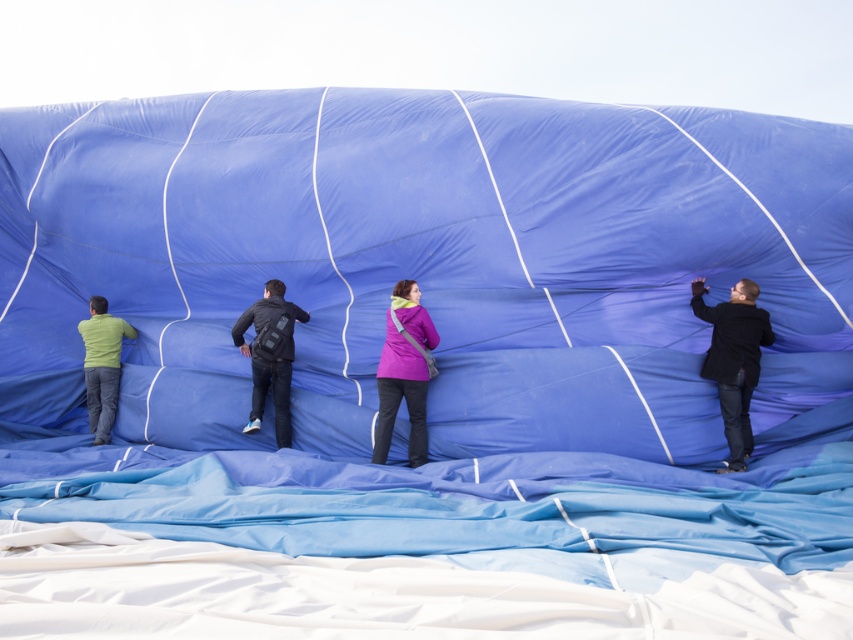
You are a photographer trying to capture a closeup shot of the purple matte jacket at center and dark blue fabric at center. Which object should you zoom in on to ensure it takes up more space in your photo?

The dark blue fabric at center is larger in size compared to the purple matte jacket at center, so zooming in on the purple matte jacket at center will make it take up more space in the photo.